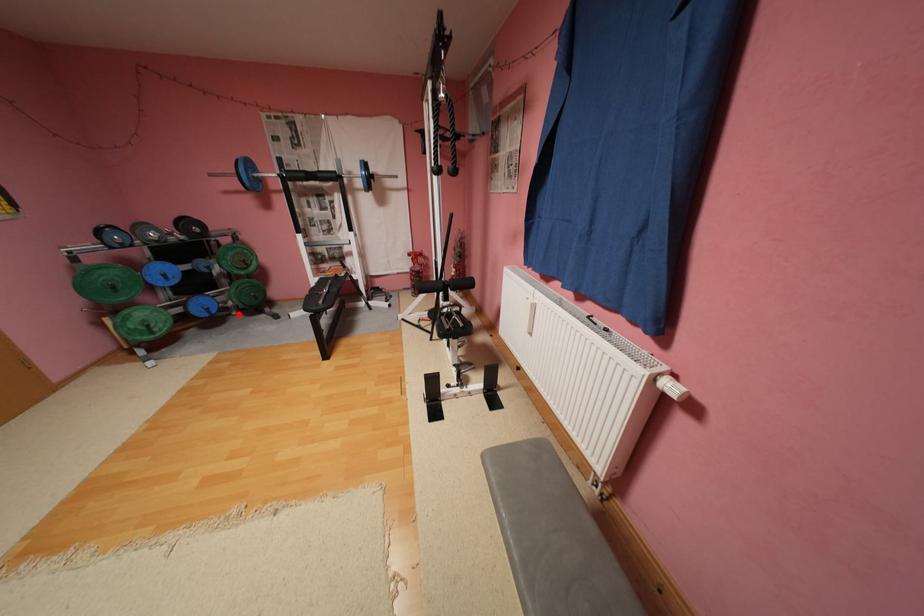
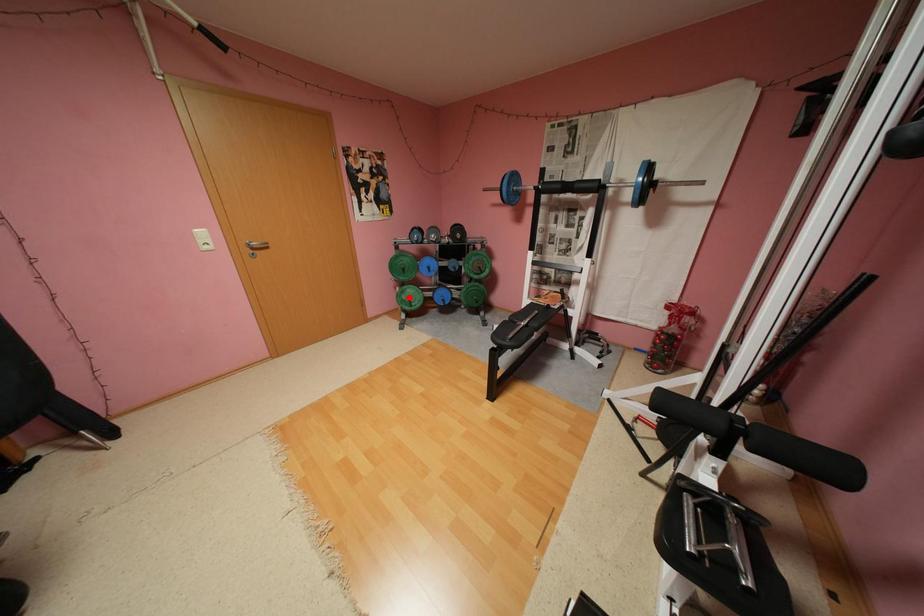
I am providing you with two images of the same scene from different viewpoints. A red point is marked on the first image and another point is marked on the second image. Is the red point in image1 aligned with the point shown in image2?

No